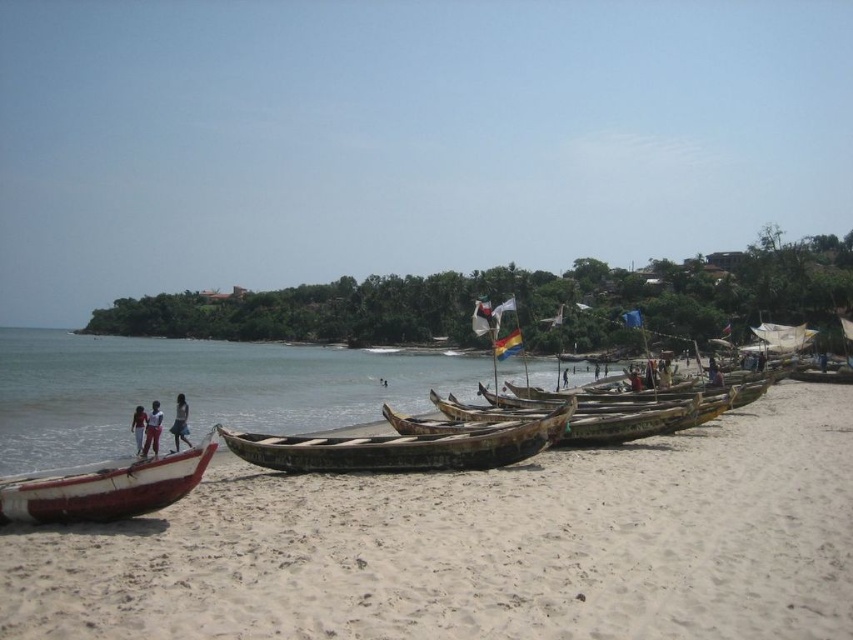
You are standing on the beach and want to walk to both the point at coordinates (91, 468) and the point at coordinates (154, 403). Which point will you reach first?

You will reach the point at coordinates (91, 468) first because it is closer to you than the point at coordinates (154, 403).

You are standing at the center of the image and want to walk to the white sandy beach at lower left. According to the coordinates provided in the description, in which direction should you move from your current position?

The white sandy beach at lower left is located at point [480,547], so you should move towards the lower left direction from your current position at the center.

You are a marine biologist examining the beach scene. You need to determine which vessel has a narrower width between the rusty wooden boat at center and the rusty wooden canoe at center. Which one is narrower?

The rusty wooden boat at center is thinner than the rusty wooden canoe at center, so the rusty wooden boat at center is narrower.